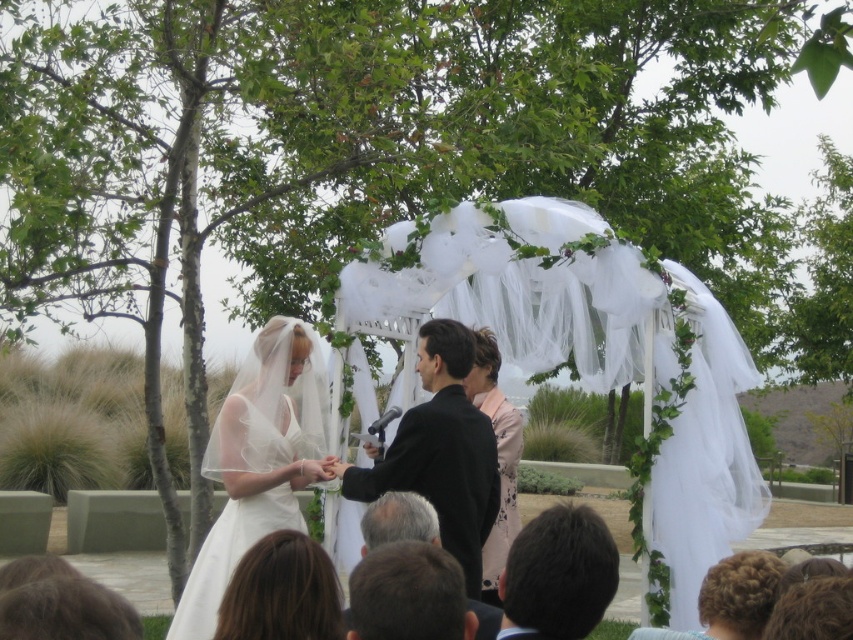
Looking at this image, can you confirm if blonde hair at lower center is wider than pink floral dress at center?

Indeed, blonde hair at lower center has a greater width compared to pink floral dress at center.

Is point (321, 602) farther from camera compared to point (476, 336)?

No.

Identify the location of blonde hair at lower center. This screenshot has height=640, width=853. (282, 593).

Between white satin dress at center and pink floral dress at center, which one appears on the right side from the viewer's perspective?

pink floral dress at center is more to the right.

Can you confirm if white satin dress at center is bigger than pink floral dress at center?

Correct, white satin dress at center is larger in size than pink floral dress at center.

Identify the location of white satin dress at center. The image size is (853, 640). (258, 461).

The height and width of the screenshot is (640, 853). Describe the element at coordinates (258, 461) in the screenshot. I see `white satin dress at center` at that location.

I want to click on white satin dress at center, so click(x=258, y=461).